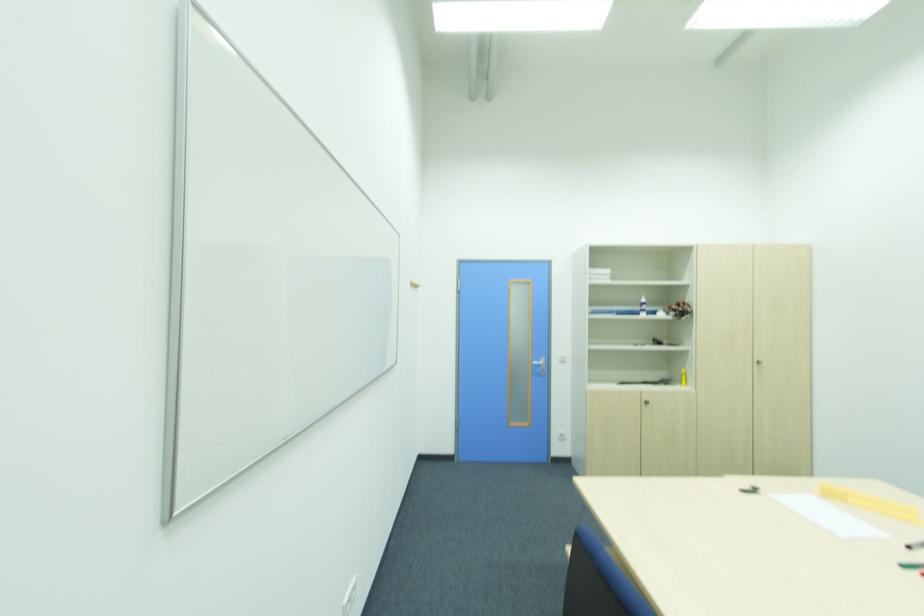
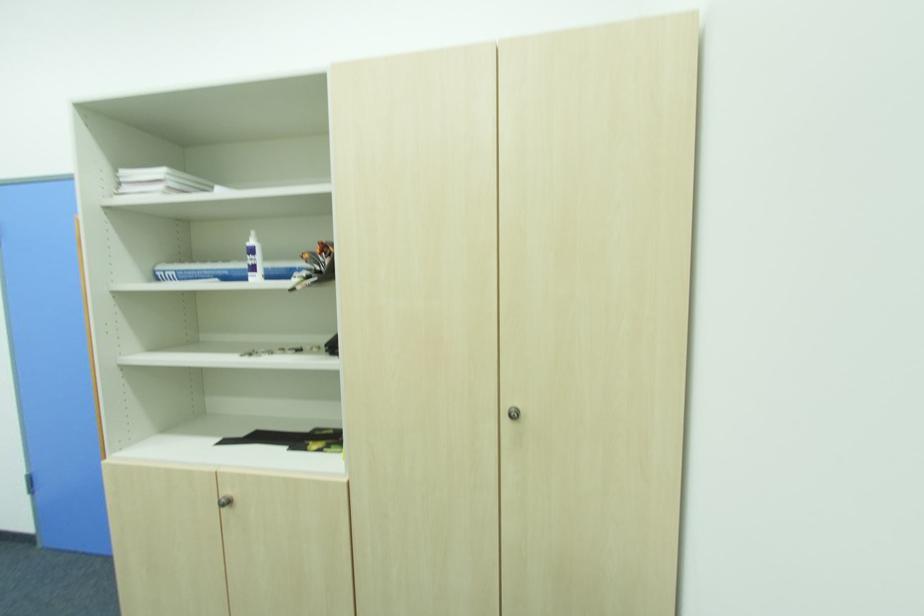
Find the pixel in the second image that matches (650,402) in the first image.

(229, 504)